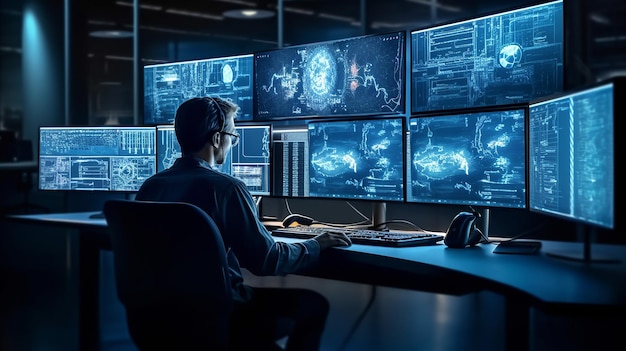
The image size is (626, 351). I want to click on computer monitors, so tap(218, 81), tap(342, 80), tap(503, 62), tap(590, 150), tap(437, 172), tap(349, 153), tap(247, 163), tap(91, 156).